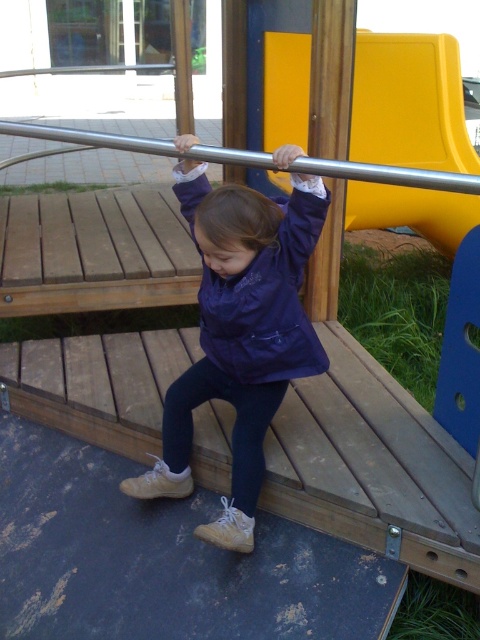
You are a photographer trying to capture the child in the purple jacket at the playground. The child is currently at point (240, 333). You want to position your camera so that the purple jacket is centered in the frame. Where should you aim your camera?

You should aim your camera at point (240, 333) to center the purple jacket at center in the frame, as that point corresponds to the purple fabric jacket at center.

You are a photographer trying to capture the child on the playground. You notice two points of interest marked as point (x=436, y=124) and point (x=242, y=314). Which point is closer to your camera lens?

Point (x=242, y=314) is closer to the camera lens because it is less further than point (x=436, y=124).